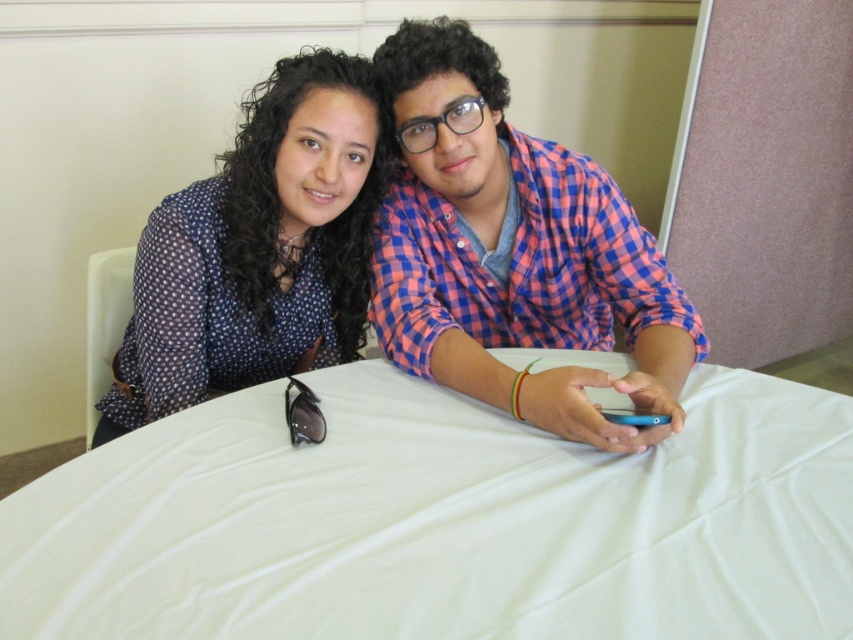
Question: Can you confirm if matte blue shirt at center is bigger than matte blue blouse at upper left?

Choices:
 (A) yes
 (B) no

Answer: (A)

Question: Which of the following is the closest to the observer?

Choices:
 (A) matte blue blouse at upper left
 (B) black plastic goggles at lower center
 (C) matte blue shirt at center

Answer: (C)

Question: Among these objects, which one is nearest to the camera?

Choices:
 (A) black plastic goggles at lower center
 (B) matte blue shirt at center

Answer: (B)

Question: Can you confirm if white cloth at center is positioned to the right of matte blue shirt at center?

Choices:
 (A) yes
 (B) no

Answer: (B)

Question: Is white cloth at center smaller than matte blue blouse at upper left?

Choices:
 (A) yes
 (B) no

Answer: (A)

Question: Estimate the real-world distances between objects in this image. Which object is farther from the matte blue blouse at upper left?

Choices:
 (A) matte blue shirt at center
 (B) white cloth at center

Answer: (B)